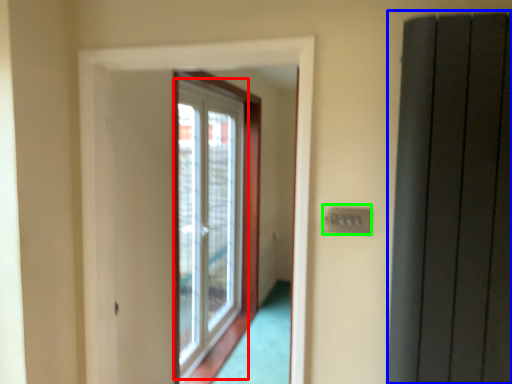
Question: Which object is the closest to the window (highlighted by a red box)? Choose among these: elevator (highlighted by a blue box) or electric outlet (highlighted by a green box).

Choices:
 (A) elevator
 (B) electric outlet

Answer: (A)